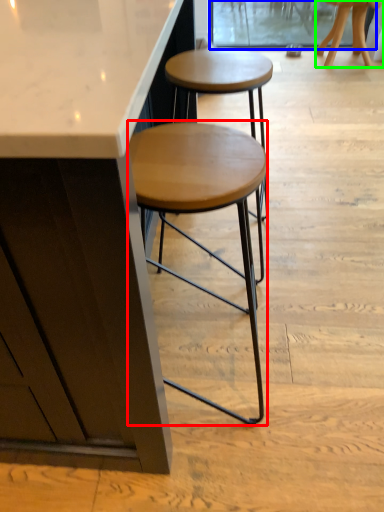
Question: Based on their relative distances, which object is farther from stool (highlighted by a red box)? Choose from screen door (highlighted by a blue box) and stool (highlighted by a green box).

Choices:
 (A) screen door
 (B) stool

Answer: (A)